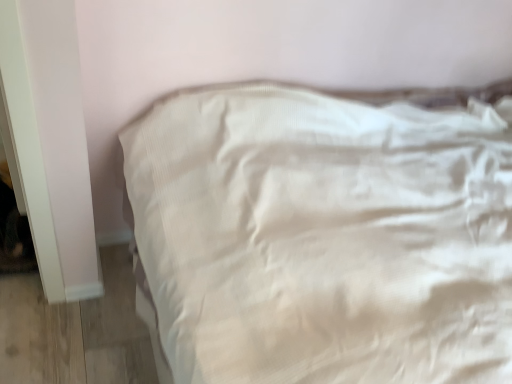
This screenshot has width=512, height=384. Find the location of `white fabric bed at center`. white fabric bed at center is located at coordinates (325, 234).

Describe the element at coordinates (325, 234) in the screenshot. I see `white fabric bed at center` at that location.

Locate an element on the screen. This screenshot has width=512, height=384. white fabric bed at center is located at coordinates pos(325,234).